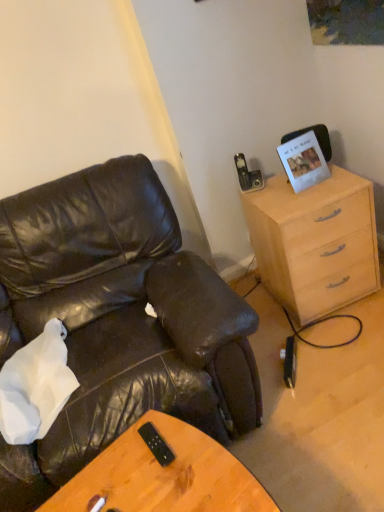
Question: From a real-world perspective, relative to matte black leather chair at left, is black plastic remote at center vertically above or below?

Choices:
 (A) below
 (B) above

Answer: (B)

Question: Is black plastic remote at center bigger or smaller than matte black leather chair at left?

Choices:
 (A) big
 (B) small

Answer: (B)

Question: Estimate the real-world distances between objects in this image. Which object is closer to the woodendesk at lower center?

Choices:
 (A) light wood/finish cabinet at right
 (B) black plastic remote at center
 (C) white paper picture frame at upper right
 (D) matte black leather chair at left

Answer: (B)

Question: Estimate the real-world distances between objects in this image. Which object is closer to the light wood/finish cabinet at right?

Choices:
 (A) white paper picture frame at upper right
 (B) matte black leather chair at left
 (C) woodendesk at lower center
 (D) black plastic remote at center

Answer: (A)